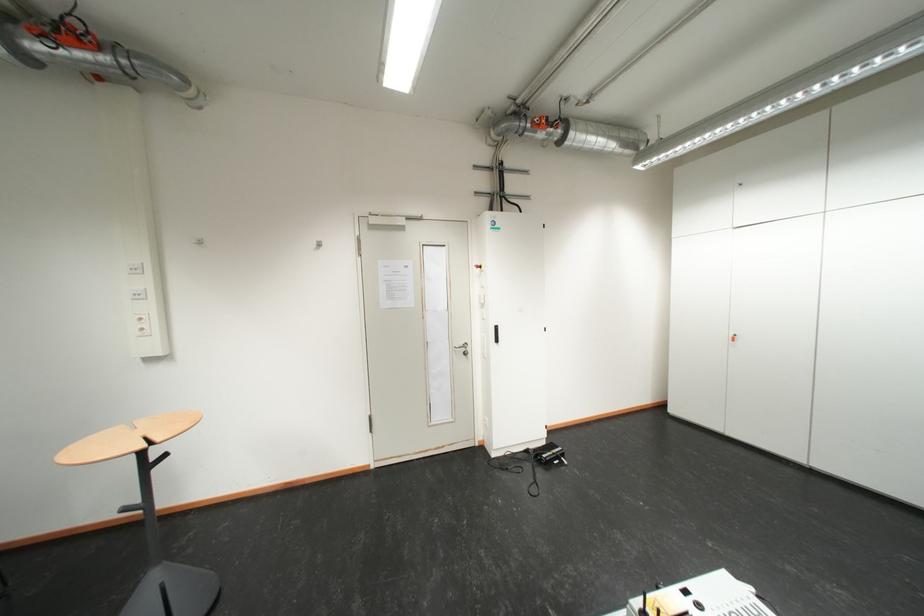
This screenshot has width=924, height=616. I want to click on white power outlet, so click(x=137, y=293).